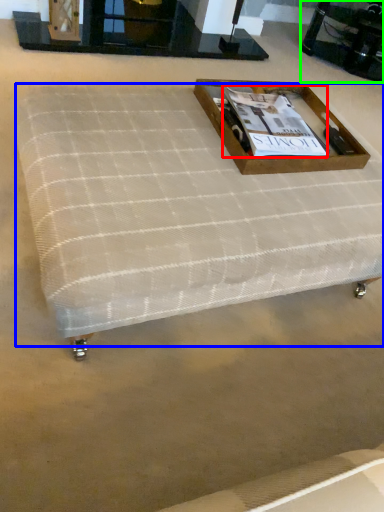
Question: Which is nearer to the magazine (highlighted by a red box)? mattress (highlighted by a blue box) or round table (highlighted by a green box).

Choices:
 (A) mattress
 (B) round table

Answer: (A)